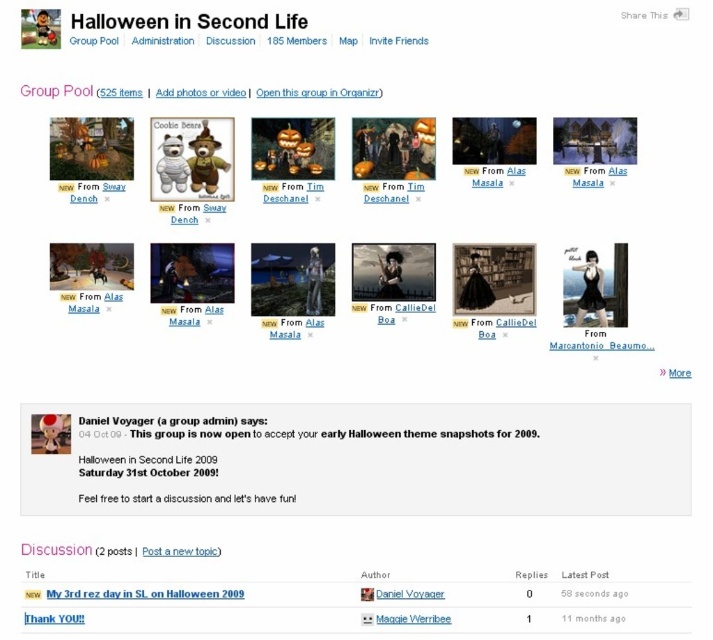
You are navigating the Halloween in Second Life webpage and see the matte black witch at center and the black matte text at upper center. Which object is positioned to the right side of the other?

The matte black witch at center is to the right of the black matte text at upper center.

You are a graphic designer working on a Halloween website layout. You need to ensure that the matte black witch at center and the gray matte text at center are positioned far enough apart so that they don not overlap. According to the design specifications, elements must be at least 20 inches apart. Can you confirm if their current spacing meets this requirement?

The matte black witch at center is 22.06 inches from the gray matte text at center, which exceeds the minimum required spacing of 20 inches. Therefore, the current spacing meets the design specifications.

You are viewing the Halloween in Second Life group page. You notice two text elements, the black matte text at upper center and the gray matte text at center. Which text element is positioned higher on the page?

The black matte text at upper center is positioned higher on the page than the gray matte text at center.